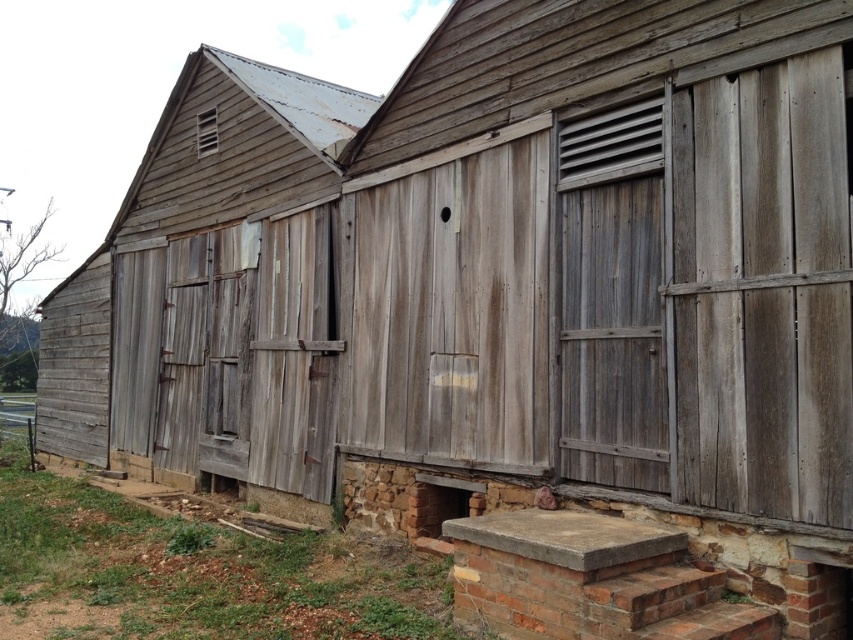
You are standing in front of the weathered wood barn at left and the weathered wood shutter at upper left. Which object is closer to you?

The weathered wood barn at left is closer to you because it is in front of the weathered wood shutter at upper left.

You are an inspector assessing the structural integrity of the weathered wood barn at left and the weathered wood shutter at right. Which object would you prioritize inspecting first based on their sizes?

The weathered wood barn at left has a larger size compared to the weathered wood shutter at right, so you should prioritize inspecting the weathered wood barn at left first because larger structures typically require more thorough evaluation for safety concerns.